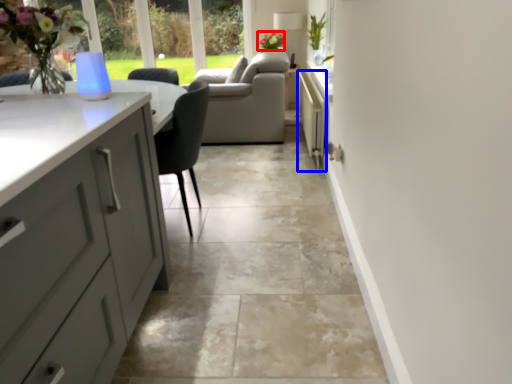
Question: Among these objects, which one is nearest to the camera, flower (highlighted by a red box) or appliance (highlighted by a blue box)?

Choices:
 (A) flower
 (B) appliance

Answer: (B)